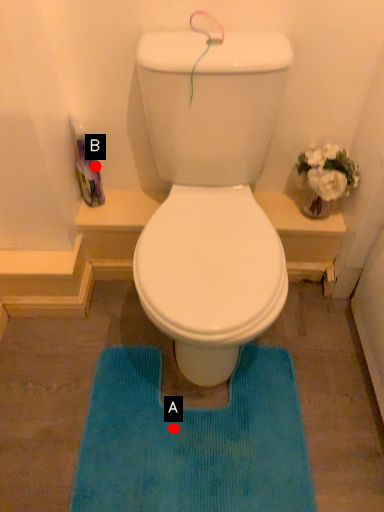
Question: Two points are circled on the image, labeled by A and B beside each circle. Which point is further to the camera?

Choices:
 (A) A is further
 (B) B is further

Answer: (B)